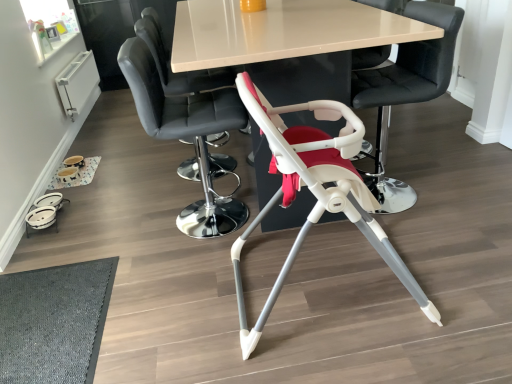
Where is `vacant space to the left of white plastic highchair at center, which appears as the 3th chair when viewed from the left`? The width and height of the screenshot is (512, 384). vacant space to the left of white plastic highchair at center, which appears as the 3th chair when viewed from the left is located at coordinates (177, 302).